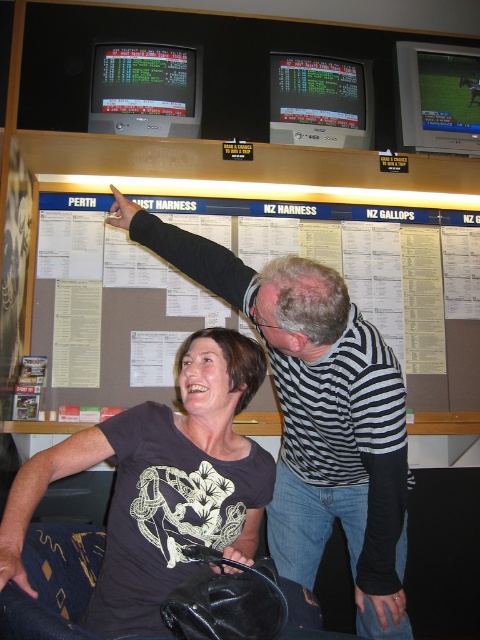
Is dark gray matte shirt at center positioned at the back of white paperboard at upper center?

No, it is in front of white paperboard at upper center.

Which is behind, point (229, 381) or point (108, 358)?

The point (108, 358) is more distant.

Does point (143, 467) come farther from viewer compared to point (128, 368)?

No, (143, 467) is closer to viewer.

I want to click on dark gray matte shirt at center, so click(160, 484).

Which is above, striped shirt at upper center or white paperboard at upper center?

white paperboard at upper center is above.

From the picture: Which is below, striped shirt at upper center or white paperboard at upper center?

Positioned lower is striped shirt at upper center.

Between point (304, 365) and point (398, 227), which one is positioned behind?

The point (398, 227) is behind.

Where is `striped shirt at upper center`? This screenshot has width=480, height=640. striped shirt at upper center is located at coordinates (316, 413).

Does striped shirt at upper center have a greater height compared to dark gray matte shirt at center?

Yes, striped shirt at upper center is taller than dark gray matte shirt at center.

Is striped shirt at upper center positioned before dark gray matte shirt at center?

No.

Who is more forward, (364, 624) or (240, 486)?

Point (240, 486) is in front.

Identify the location of striped shirt at upper center. The image size is (480, 640). coord(316,413).